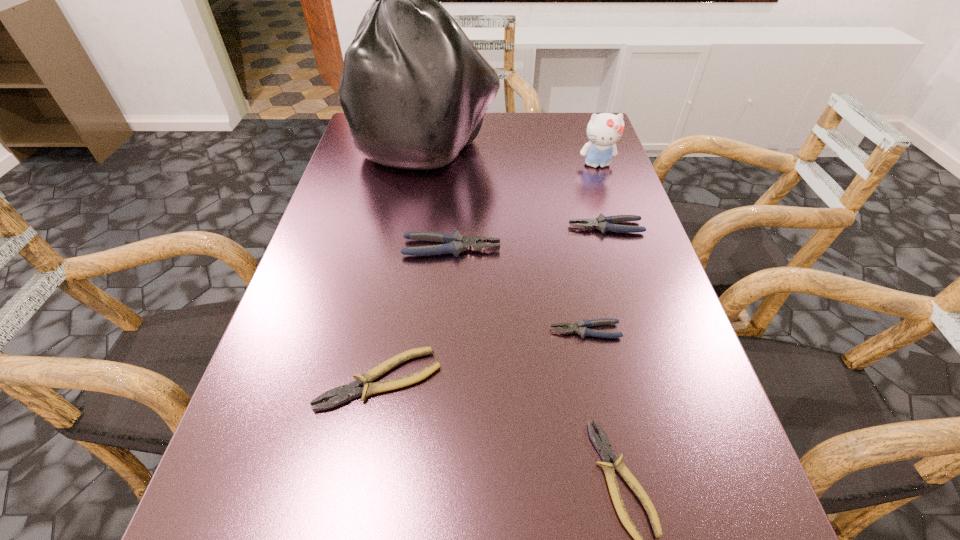
I want to click on object present at the far edge, so click(x=414, y=90).

You are a GUI agent. You are given a task and a screenshot of the screen. Output one action in this format:
    pyautogui.click(x=<x>, y=<y>)
    Task: Click on the plastic bag located in the left edge section of the desktop
    The image size is (960, 540).
    Given the screenshot: What is the action you would take?
    pyautogui.click(x=414, y=90)

Identify the location of pliers situated at the left edge. This screenshot has width=960, height=540. (346, 392).

Image resolution: width=960 pixels, height=540 pixels. I want to click on kitten positioned at the right edge, so click(x=604, y=130).

I want to click on object at the far left corner, so click(x=414, y=90).

You are a GUI agent. You are given a task and a screenshot of the screen. Output one action in this format:
    pyautogui.click(x=<x>, y=<y>)
    Task: Click on the vacant space at the far edge
    This screenshot has width=960, height=540.
    Given the screenshot: What is the action you would take?
    pyautogui.click(x=489, y=127)

In the image, there is a desktop. In order to click on vacant space at the left edge in this screenshot , I will do `click(353, 245)`.

Image resolution: width=960 pixels, height=540 pixels. Find the location of `free space at the right edge`. free space at the right edge is located at coordinates (636, 335).

Where is `free space at the far right corner`? This screenshot has width=960, height=540. free space at the far right corner is located at coordinates (573, 118).

You are a GUI agent. You are given a task and a screenshot of the screen. Output one action in this format:
    pyautogui.click(x=<x>, y=<y>)
    Task: Click on the free space between the third farthest object and the tallest pliers
    The image size is (960, 540).
    Given the screenshot: What is the action you would take?
    pyautogui.click(x=529, y=238)